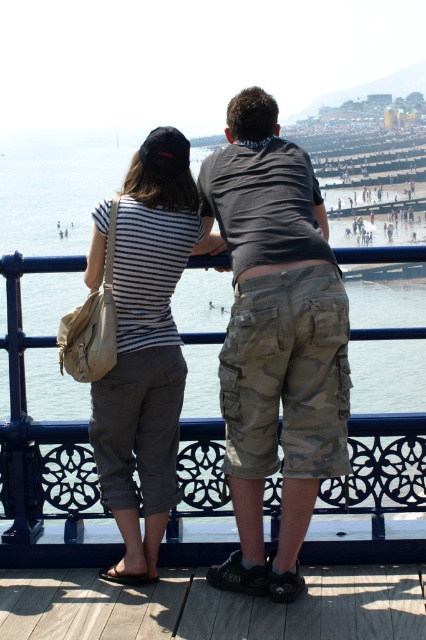
Who is higher up, clear blue water at center or striped cotton shirt at center?

clear blue water at center is above.

Between clear blue water at center and striped cotton shirt at center, which one has more height?

With more height is clear blue water at center.

Based on the photo, who is more forward, (365, 465) or (175, 262)?

Point (175, 262)

At what (x,y) coordinates should I click in order to perform the action: click on clear blue water at center. Please return your answer as a coordinate pair (x, y). Looking at the image, I should click on (43, 397).

Is camo shorts at center to the right of striped cotton shirt at center from the viewer's perspective?

Yes, camo shorts at center is to the right of striped cotton shirt at center.

The width and height of the screenshot is (426, 640). What do you see at coordinates (275, 339) in the screenshot?
I see `camo shorts at center` at bounding box center [275, 339].

Find the location of a particular element. This screenshot has width=426, height=640. camo shorts at center is located at coordinates (275, 339).

Can you confirm if camo shorts at center is positioned to the right of clear blue water at center?

Yes, camo shorts at center is to the right of clear blue water at center.

Is camo shorts at center bigger than clear blue water at center?

Incorrect, camo shorts at center is not larger than clear blue water at center.

Which is behind, point (287, 314) or point (371, 250)?

The point (371, 250) is behind.

You are a GUI agent. You are given a task and a screenshot of the screen. Output one action in this format:
    pyautogui.click(x=<x>, y=<y>)
    Task: Click on the camo shorts at center
    The image size is (426, 640).
    Given the screenshot: What is the action you would take?
    pyautogui.click(x=275, y=339)